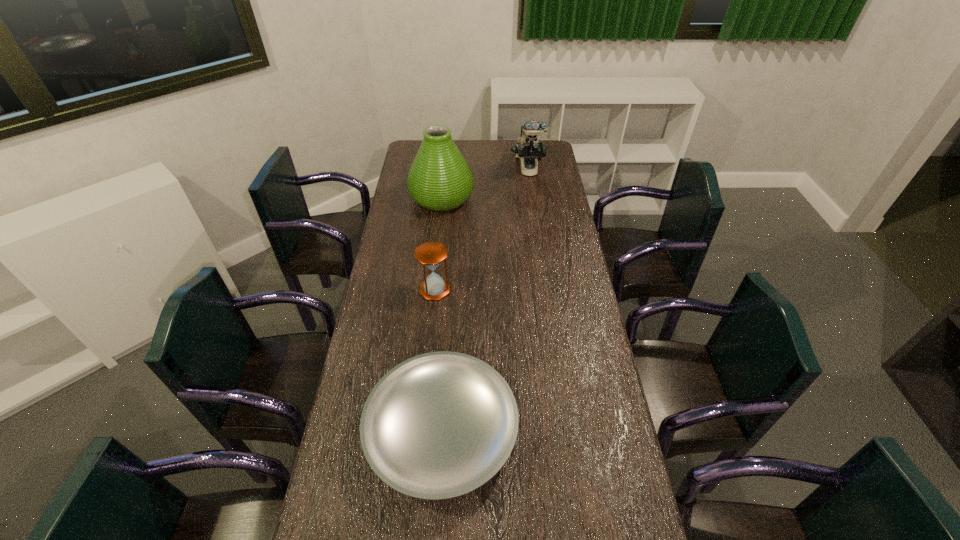
Identify the location of object situated at the far edge. (528, 149).

This screenshot has width=960, height=540. In order to click on vase at the left edge in this screenshot , I will do `click(440, 179)`.

Locate an element on the screen. bedpan located in the left edge section of the desktop is located at coordinates (439, 425).

The image size is (960, 540). Identify the location of object situated at the right edge. tap(528, 149).

Where is `object that is at the far right corner`? This screenshot has height=540, width=960. object that is at the far right corner is located at coordinates (528, 149).

The image size is (960, 540). In the image, there is a desktop. In order to click on vacant space at the far edge in this screenshot , I will do `click(512, 154)`.

Where is `vacant region at the left edge of the desktop`? The image size is (960, 540). vacant region at the left edge of the desktop is located at coordinates (355, 497).

You are a GUI agent. You are given a task and a screenshot of the screen. Output one action in this format:
    pyautogui.click(x=<x>, y=<y>)
    Task: Click on the free space at the right edge of the desktop
    
    Given the screenshot: What is the action you would take?
    pyautogui.click(x=600, y=535)

I want to click on free spot between the vase and the microscope, so click(485, 184).

Where is `vacant space in between the rightmost object and the nearest object`? vacant space in between the rightmost object and the nearest object is located at coordinates (485, 300).